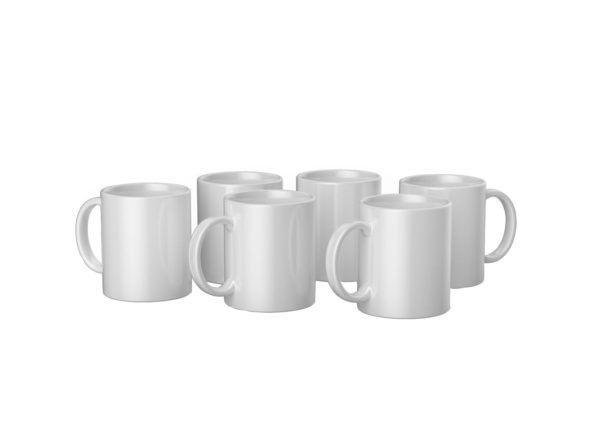
What are the coordinates of `white mug` in the screenshot? It's located at (453, 202), (420, 248), (328, 202), (256, 238), (207, 175), (149, 253).